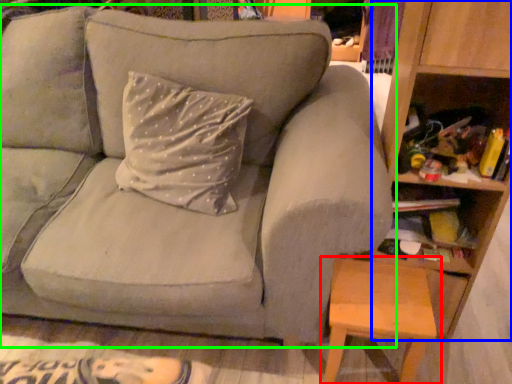
Question: Which object is the closest to the table (highlighted by a red box)? Choose among these: bookshelf (highlighted by a blue box) or studio couch (highlighted by a green box).

Choices:
 (A) bookshelf
 (B) studio couch

Answer: (A)